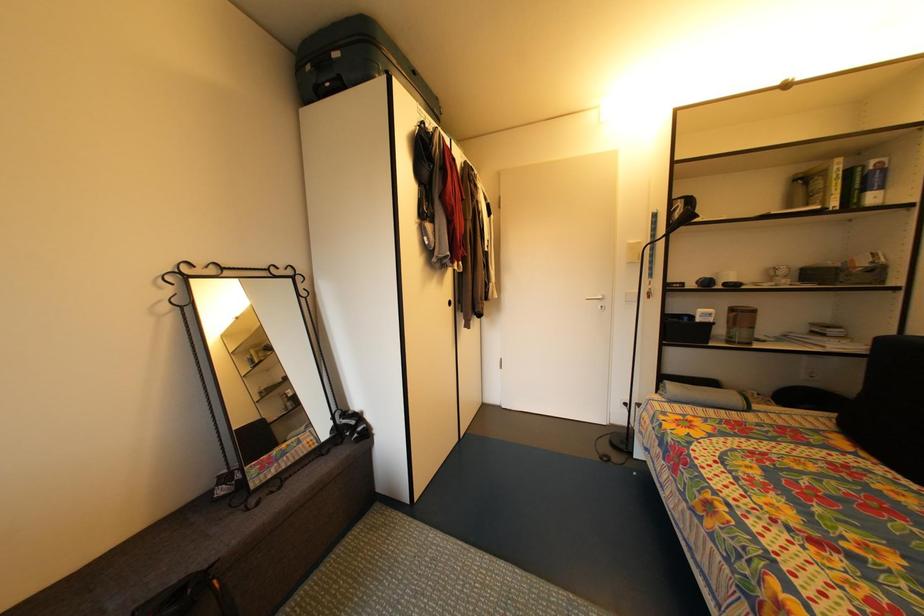
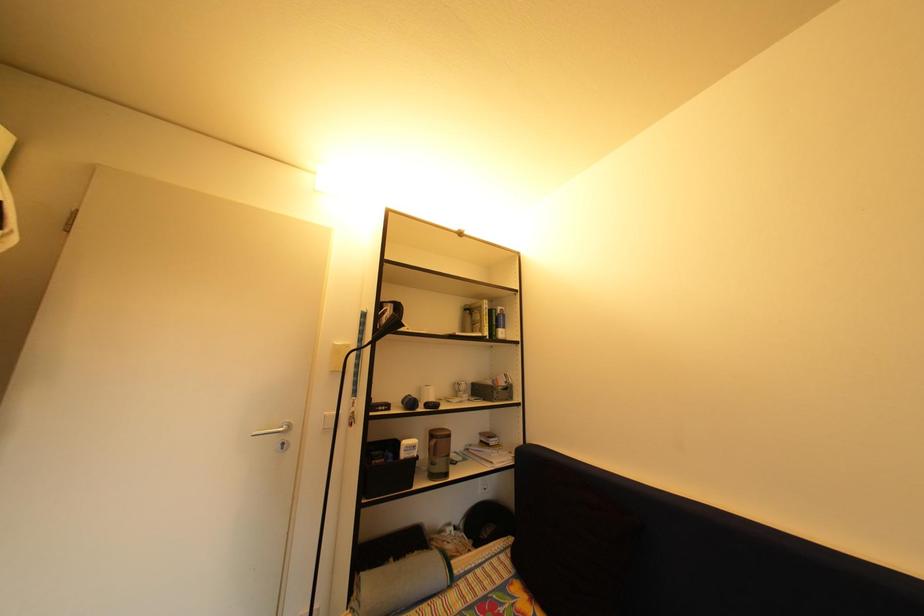
The images are taken continuously from a first-person perspective. In which direction is your viewpoint rotating?

The rotation direction of the camera is right-up.